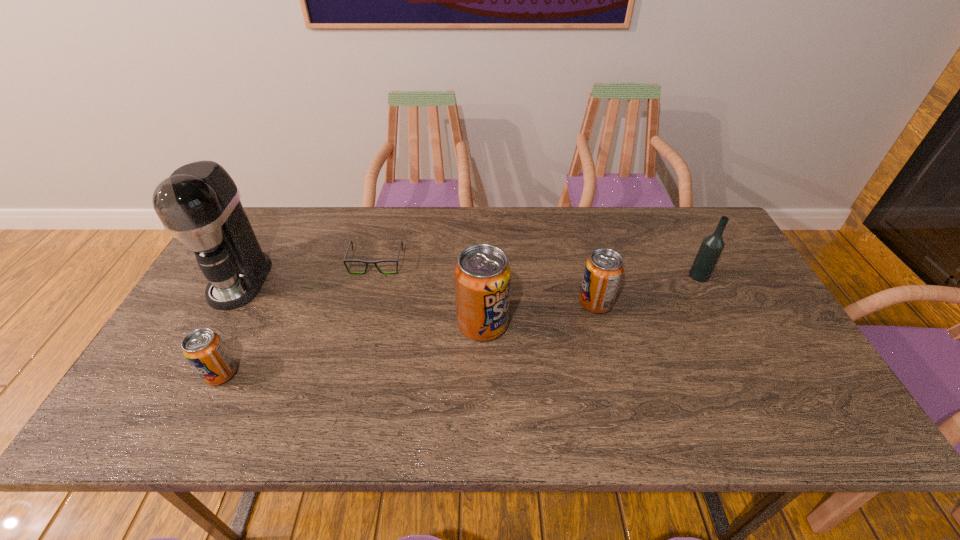
Image resolution: width=960 pixels, height=540 pixels. What are the coordinates of `vacant position for inserting another pop_(soda) evenly` in the screenshot? It's located at (358, 348).